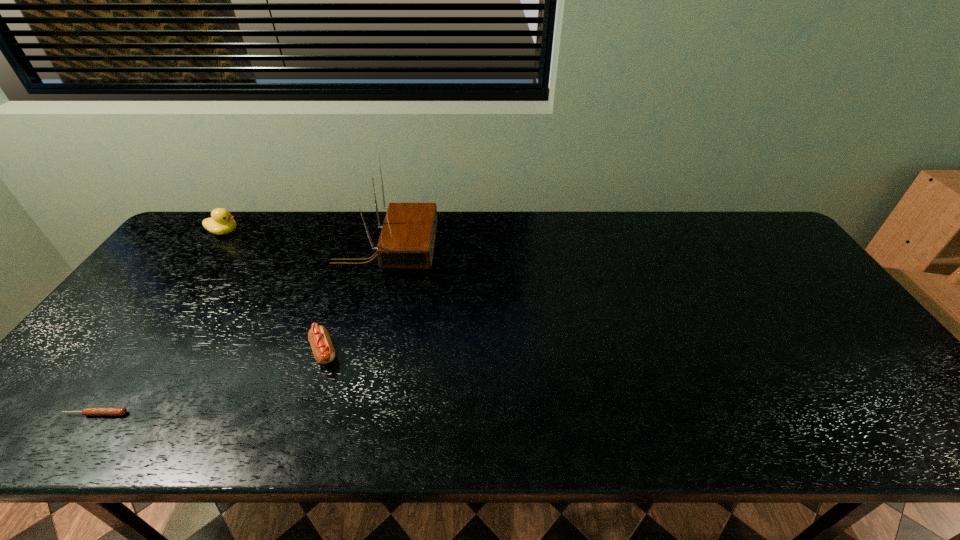
Locate an element on the screen. Image resolution: width=960 pixels, height=540 pixels. unoccupied position between the third tallest object and the tallest object is located at coordinates (354, 300).

Locate an element on the screen. object identified as the second closest to the third farthest object is located at coordinates (86, 411).

Where is `the third closest object to the right sausage`? This screenshot has width=960, height=540. the third closest object to the right sausage is located at coordinates (221, 222).

Where is `free space that satisfies the following two spatial constraints: 1. on the beak of the shorter sausage; 2. on the left side of the duckling`? This screenshot has height=540, width=960. free space that satisfies the following two spatial constraints: 1. on the beak of the shorter sausage; 2. on the left side of the duckling is located at coordinates (92, 414).

The width and height of the screenshot is (960, 540). I want to click on vacant point that satisfies the following two spatial constraints: 1. on the beak of the second tallest object; 2. on the right side of the left sausage, so (x=92, y=414).

This screenshot has height=540, width=960. I want to click on vacant area that satisfies the following two spatial constraints: 1. on the back side of the third tallest object; 2. on the right side of the nearer sausage, so click(x=140, y=352).

Where is `vacant space that satisfies the following two spatial constraints: 1. on the beak of the shortest object; 2. on the right side of the duckling`? Image resolution: width=960 pixels, height=540 pixels. vacant space that satisfies the following two spatial constraints: 1. on the beak of the shortest object; 2. on the right side of the duckling is located at coordinates (92, 414).

You are a GUI agent. You are given a task and a screenshot of the screen. Output one action in this format:
    pyautogui.click(x=<x>, y=<y>)
    Task: Click on the vacant position in the image that satisfies the following two spatial constraints: 1. on the beak of the second shortest object; 2. on the left side of the duckling
    
    Given the screenshot: What is the action you would take?
    pyautogui.click(x=137, y=352)

Identify the location of free space in the image that satisfies the following two spatial constraints: 1. on the front panel of the radio_receiver; 2. on the front side of the nearest object. This screenshot has width=960, height=540. (343, 414).